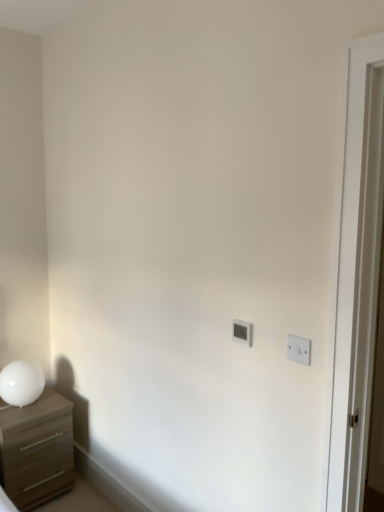
Question: Is white plastic light switch at upper right, the first light switch when ordered from front to back, directly adjacent to white glossy table lamp at left?

Choices:
 (A) yes
 (B) no

Answer: (B)

Question: From a real-world perspective, does white plastic light switch at upper right, marked as the first light switch in a right-to-left arrangement, stand above white glossy table lamp at left?

Choices:
 (A) yes
 (B) no

Answer: (A)

Question: Is white glossy table lamp at left a part of white plastic light switch at upper right, which is the 2th light switch in back-to-front order?

Choices:
 (A) yes
 (B) no

Answer: (B)

Question: Considering the relative sizes of white plastic light switch at upper right, which appears as the second light switch when viewed from the left, and white glossy table lamp at left in the image provided, is white plastic light switch at upper right, which appears as the second light switch when viewed from the left, wider than white glossy table lamp at left?

Choices:
 (A) yes
 (B) no

Answer: (B)

Question: From the image's perspective, is white plastic light switch at upper right, marked as the first light switch in a right-to-left arrangement, below white glossy table lamp at left?

Choices:
 (A) no
 (B) yes

Answer: (A)

Question: From a real-world perspective, is white glossy table lamp at left positioned above or below white plastic light switch at upper right, which is the 2th light switch in back-to-front order?

Choices:
 (A) below
 (B) above

Answer: (A)

Question: In the image, is white glossy table lamp at left positioned in front of or behind white plastic light switch at upper right, which appears as the second light switch when viewed from the left?

Choices:
 (A) behind
 (B) front

Answer: (A)

Question: Visually, is white glossy table lamp at left positioned to the left or to the right of white plastic light switch at upper right, which is the 2th light switch in back-to-front order?

Choices:
 (A) left
 (B) right

Answer: (A)

Question: From their relative heights in the image, would you say white glossy table lamp at left is taller or shorter than white plastic light switch at upper right, which is the 2th light switch in back-to-front order?

Choices:
 (A) short
 (B) tall

Answer: (B)

Question: Is point (46, 392) closer or farther from the camera than point (18, 389)?

Choices:
 (A) farther
 (B) closer

Answer: (A)

Question: Looking at the image, does matte brown chest of drawers at left seem bigger or smaller compared to white glossy table lamp at left?

Choices:
 (A) small
 (B) big

Answer: (B)

Question: From a real-world perspective, is matte brown chest of drawers at left above or below white glossy table lamp at left?

Choices:
 (A) below
 (B) above

Answer: (A)

Question: Visually, is matte brown chest of drawers at left positioned to the left or to the right of white glossy table lamp at left?

Choices:
 (A) left
 (B) right

Answer: (B)

Question: In the image, is white plastic light switch at upper right, the first light switch when ordered from front to back, on the left side or the right side of white glossy table lamp at left?

Choices:
 (A) right
 (B) left

Answer: (A)

Question: Looking at the image, does white plastic light switch at upper right, which is the 2th light switch in back-to-front order, seem bigger or smaller compared to white glossy table lamp at left?

Choices:
 (A) big
 (B) small

Answer: (B)